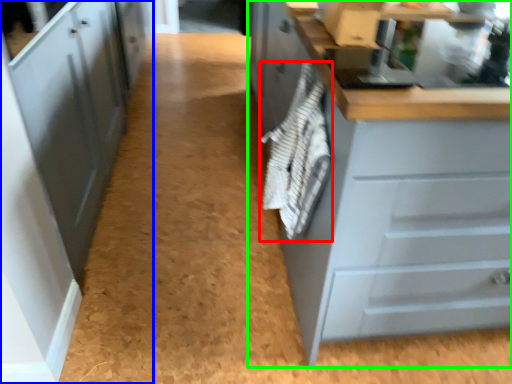
Question: Considering the real-world distances, which object is farthest from material (highlighted by a red box)? cabinetry (highlighted by a blue box) or cabinetry (highlighted by a green box)?

Choices:
 (A) cabinetry
 (B) cabinetry

Answer: (A)